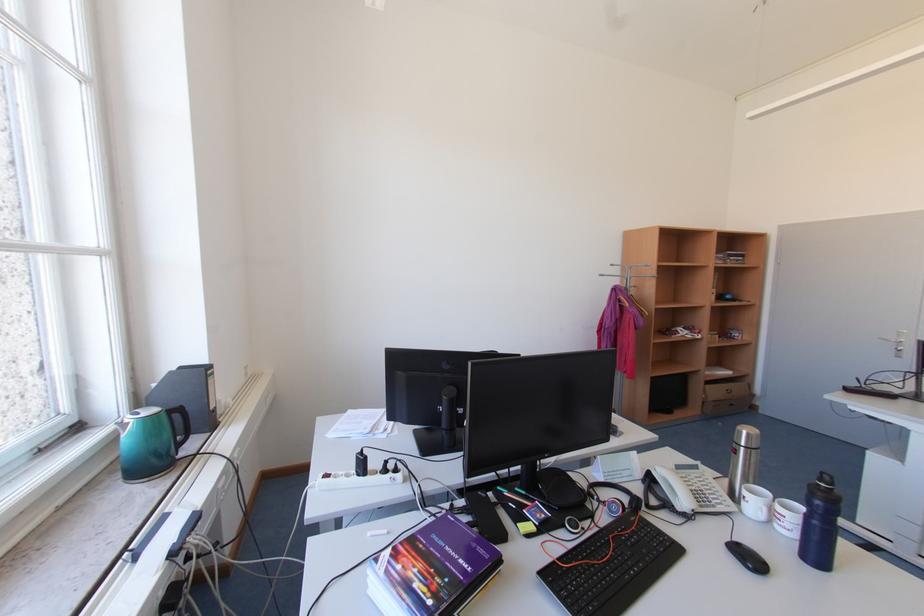
Where would you open the purple book? Please return your answer as a coordinate pair (x, y).

(432, 570)